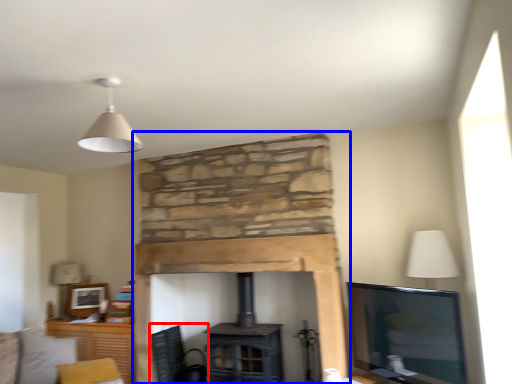
Question: Which object appears closest to the camera in this image, swivel chair (highlighted by a red box) or fireplace (highlighted by a blue box)?

Choices:
 (A) swivel chair
 (B) fireplace

Answer: (B)